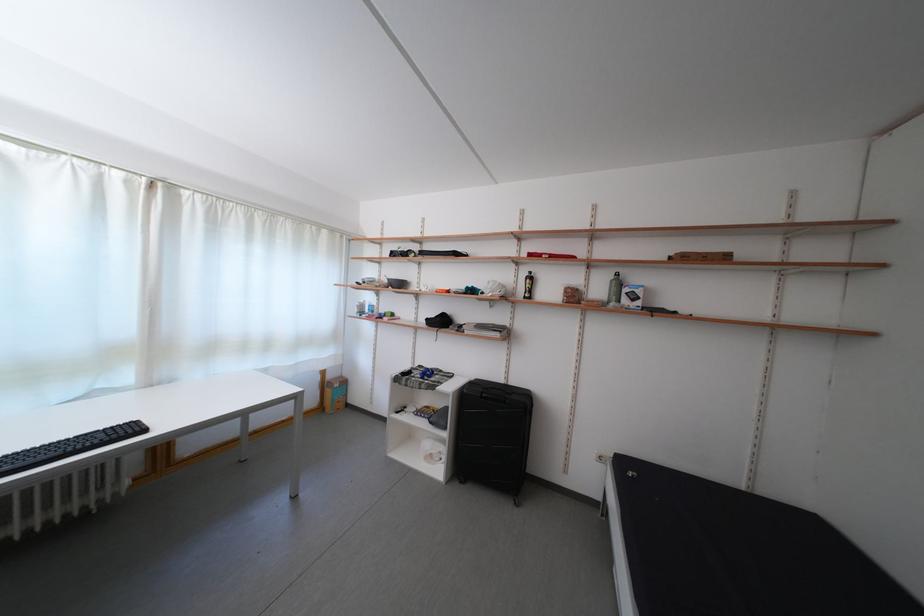
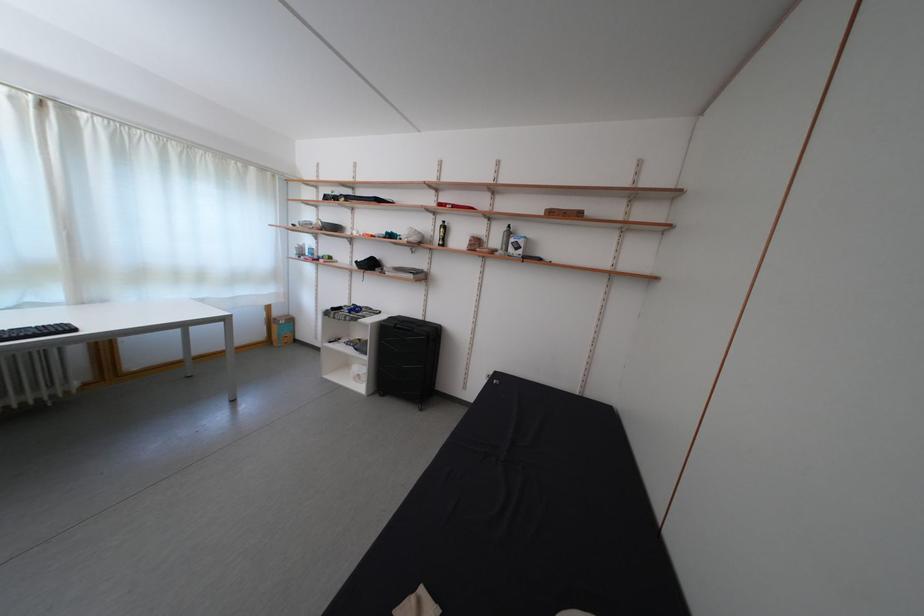
Locate, in the second image, the point that corresponds to point (338, 382) in the first image.

(285, 320)